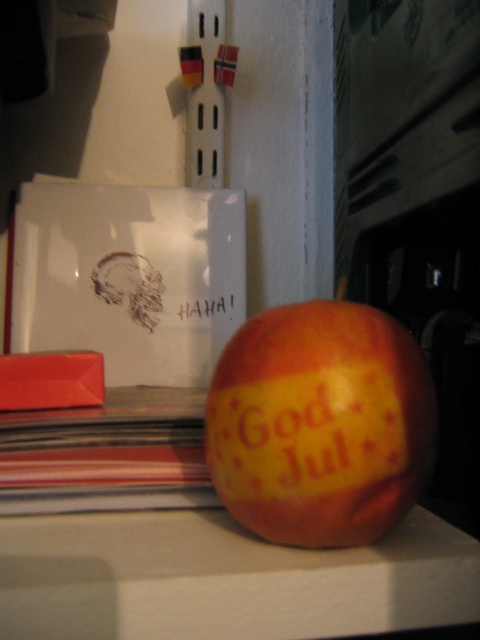
You are holding a ruler and want to measure the distance between you and the red matte apple at center. If your eyes are 5 feet away from the surface you are looking at, can you reach the apple without moving your body?

The red matte apple at center is 12.82 inches away from viewer. Since 12.82 inches is less than 5 feet, you can reach the apple without moving your body.

You are trying to read the yellow matte text at center but the red matte apple at center is blocking your view. Can you move the apple to see the text?

The red matte apple at center is in front of the yellow matte text at center, so moving the apple would allow you to see the text.

You are an artist trying to paint the scene. You need to decide which object to focus on first based on their sizes. Which one should you focus on first, the red matte apple at center or the yellow matte text at center?

The red matte apple at center is larger in size than the yellow matte text at center, so you should focus on the red matte apple at center first because it is bigger and likely the main subject.